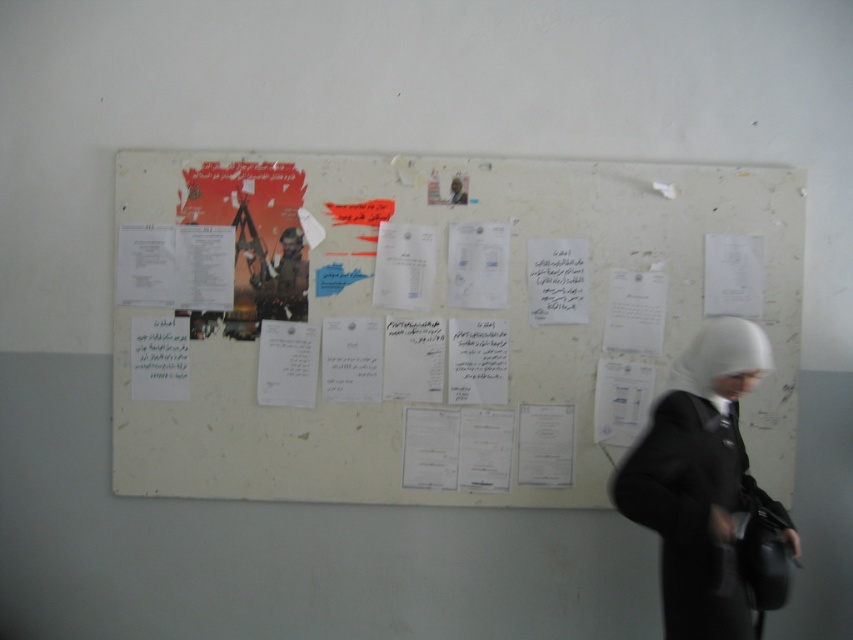
Question: Estimate the real-world distances between objects in this image. Which object is closer to the camouflage fabric soldier at center?

Choices:
 (A) white matte hijab at center
 (B) white matte paper at center

Answer: (B)

Question: Which object is positioned farthest from the white matte paper at center?

Choices:
 (A) white matte hijab at center
 (B) camouflage fabric soldier at center

Answer: (A)

Question: Is white matte paper at center smaller than white matte hijab at center?

Choices:
 (A) no
 (B) yes

Answer: (A)

Question: Which object appears farthest from the camera in this image?

Choices:
 (A) camouflage fabric soldier at center
 (B) white matte hijab at center
 (C) white matte paper at center

Answer: (A)

Question: Can you confirm if white matte hijab at center is bigger than camouflage fabric soldier at center?

Choices:
 (A) no
 (B) yes

Answer: (B)

Question: Where is white matte hijab at center located in relation to camouflage fabric soldier at center in the image?

Choices:
 (A) right
 (B) left

Answer: (A)